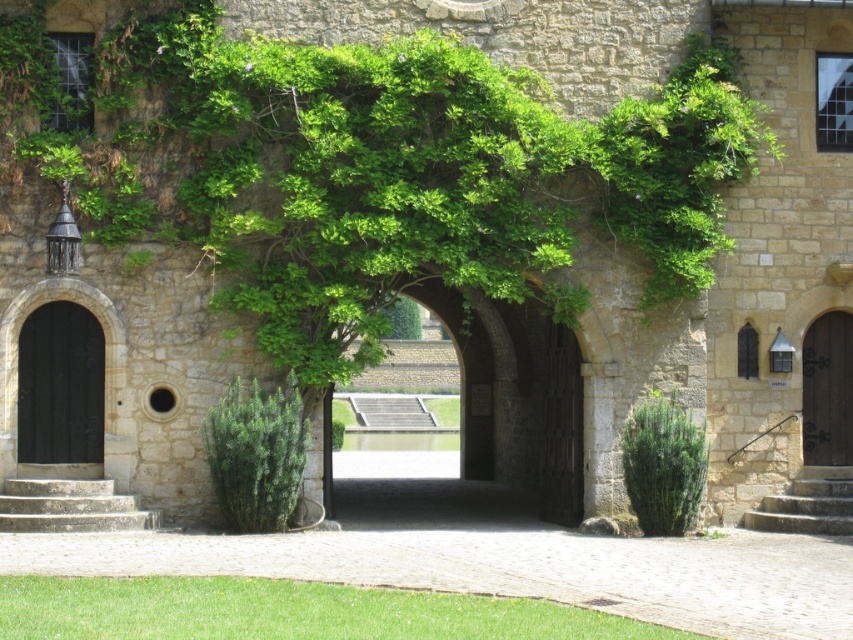
You are a delivery person carrying a package that is 2 meters tall. You need to enter the building through either the matte black door at left or the stone stairs at lower right. Based on their heights, which entrance can your package fit through?

A: The matte black door at left has a greater height compared to stone stairs at lower right, so the package can fit through the matte black door at left.

You are a visitor approaching the entrance of the historic stone building. You notice two doors on either side of the main archway. The left side has a matte black door at left and the right side has a brown wooden door at right. Which door is closer to you as you approach the building?

The matte black door at left is closer to you as you approach the building because it is in front of the brown wooden door at right.